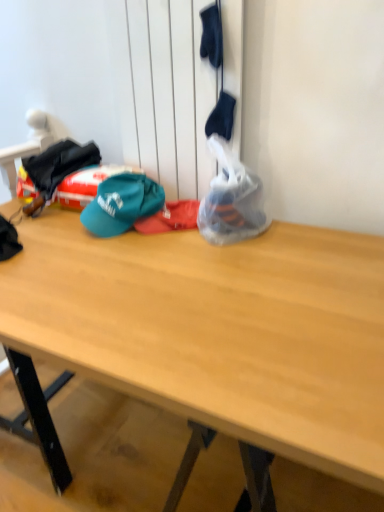
Describe the element at coordinates (231, 199) in the screenshot. I see `translucent plastic bag at center` at that location.

The height and width of the screenshot is (512, 384). I want to click on wooden desk at center, so click(211, 337).

Which is more to the right, translucent plastic bag at center or teal fabric cap at center?

Positioned to the right is translucent plastic bag at center.

Consider the image. From a real-world perspective, who is located lower, translucent plastic bag at center or teal fabric cap at center?

From a 3D spatial view, teal fabric cap at center is below.

From their relative heights in the image, would you say translucent plastic bag at center is taller or shorter than teal fabric cap at center?

Considering their sizes, translucent plastic bag at center has more height than teal fabric cap at center.

You are a GUI agent. You are given a task and a screenshot of the screen. Output one action in this format:
    pyautogui.click(x=<x>, y=<y>)
    Task: Click on the hat lying on the left of translucent plastic bag at center
    The width and height of the screenshot is (384, 512).
    Given the screenshot: What is the action you would take?
    pyautogui.click(x=122, y=204)

Which is behind, teal fabric cap at center or translucent plastic bag at center?

teal fabric cap at center.

Is teal fabric cap at center positioned with its back to translucent plastic bag at center?

No, translucent plastic bag at center is not at the back of teal fabric cap at center.

Based on the photo, from the image's perspective, is teal fabric cap at center below translucent plastic bag at center?

Yes, from the image's perspective, teal fabric cap at center is below translucent plastic bag at center.

Based on their sizes in the image, would you say teal fabric cap at center is bigger or smaller than translucent plastic bag at center?

In the image, teal fabric cap at center appears to be smaller than translucent plastic bag at center.

Which is more to the right, wooden desk at center or teal fabric cap at center?

wooden desk at center is more to the right.

Who is smaller, wooden desk at center or teal fabric cap at center?

Smaller between the two is teal fabric cap at center.

From the image's perspective, relative to teal fabric cap at center, is wooden desk at center above or below?

Clearly, from the image's perspective, wooden desk at center is below teal fabric cap at center.

You are a GUI agent. You are given a task and a screenshot of the screen. Output one action in this format:
    pyautogui.click(x=<x>, y=<y>)
    Task: Click on the hat behind the wooden desk at center
    The height and width of the screenshot is (512, 384).
    Given the screenshot: What is the action you would take?
    pyautogui.click(x=122, y=204)

What's the angular difference between translucent plastic bag at center and wooden desk at center's facing directions?

The angular difference between translucent plastic bag at center and wooden desk at center is 92.3 degrees.

Is translucent plastic bag at center not near wooden desk at center?

Actually, translucent plastic bag at center and wooden desk at center are a little close together.

In the scene shown: Is wooden desk at center located within translucent plastic bag at center?

No, wooden desk at center is not inside translucent plastic bag at center.

From a real-world perspective, between wooden desk at center and translucent plastic bag at center, who is vertically lower?

From a 3D spatial view, wooden desk at center is below.

Considering the points (301, 368) and (266, 223), which point is in front, point (301, 368) or point (266, 223)?

The point (301, 368) is closer.

Can you confirm if wooden desk at center is thinner than translucent plastic bag at center?

In fact, wooden desk at center might be wider than translucent plastic bag at center.

Is wooden desk at center at the left side of translucent plastic bag at center?

Yes.

Is teal fabric cap at center positioned in front of wooden desk at center?

No, the depth of teal fabric cap at center is greater than that of wooden desk at center.

Is teal fabric cap at center far from wooden desk at center?

No, teal fabric cap at center is not far from wooden desk at center.

Considering the positions of point (144, 191) and point (296, 346), is point (144, 191) closer or farther from the camera than point (296, 346)?

Point (144, 191) appears to be farther away from the viewer than point (296, 346).

Considering the relative sizes of teal fabric cap at center and wooden desk at center in the image provided, is teal fabric cap at center thinner than wooden desk at center?

Correct, the width of teal fabric cap at center is less than that of wooden desk at center.

The width and height of the screenshot is (384, 512). I want to click on plastic bag lying in front of the teal fabric cap at center, so click(x=231, y=199).

This screenshot has width=384, height=512. I want to click on plastic bag above the teal fabric cap at center (from a real-world perspective), so click(231, 199).

Based on the photo, based on their spatial positions, is teal fabric cap at center or translucent plastic bag at center closer to wooden desk at center?

translucent plastic bag at center is closer to wooden desk at center.

When comparing their distances from teal fabric cap at center, does wooden desk at center or translucent plastic bag at center seem closer?

The object closer to teal fabric cap at center is translucent plastic bag at center.

Based on their spatial positions, is translucent plastic bag at center or teal fabric cap at center further from wooden desk at center?

teal fabric cap at center is positioned further to the anchor wooden desk at center.

From the image, which object appears to be nearer to teal fabric cap at center, translucent plastic bag at center or wooden desk at center?

Among the two, translucent plastic bag at center is located nearer to teal fabric cap at center.

From the image, which object appears to be nearer to translucent plastic bag at center, teal fabric cap at center or wooden desk at center?

teal fabric cap at center lies closer to translucent plastic bag at center than the other object.

When comparing their distances from translucent plastic bag at center, does wooden desk at center or teal fabric cap at center seem further?

wooden desk at center lies further to translucent plastic bag at center than the other object.

Identify the location of hat between translucent plastic bag at center and wooden desk at center vertically. The width and height of the screenshot is (384, 512). (122, 204).